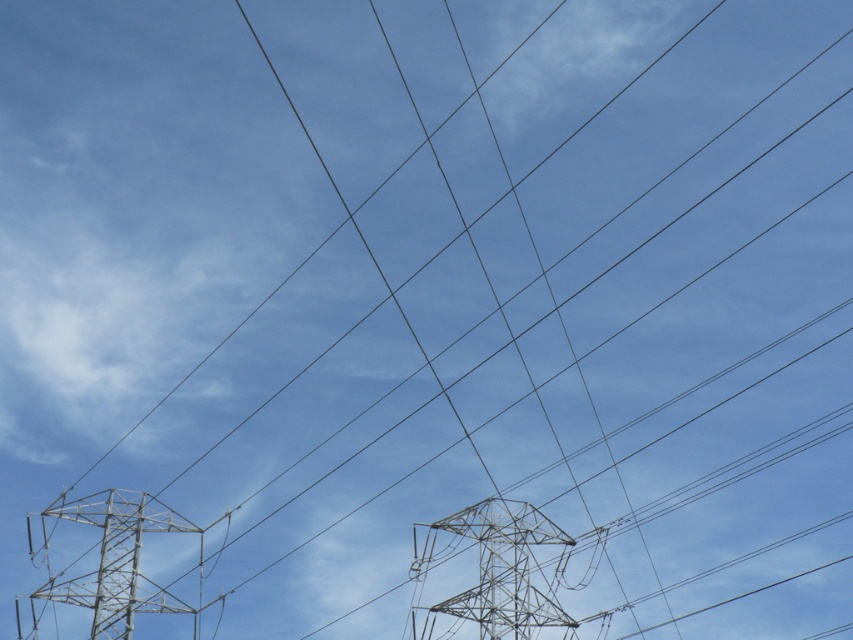
Question: Which point is farther to the camera?

Choices:
 (A) (515, 547)
 (B) (132, 604)

Answer: (B)

Question: Can you confirm if metallic silver tower at center is positioned to the right of metallic silver tower at lower left?

Choices:
 (A) yes
 (B) no

Answer: (A)

Question: Can you confirm if metallic silver tower at center is bigger than metallic silver tower at lower left?

Choices:
 (A) yes
 (B) no

Answer: (B)

Question: Which point is farther to the camera?

Choices:
 (A) metallic silver tower at center
 (B) metallic silver tower at lower left

Answer: (B)

Question: Does metallic silver tower at center appear under metallic silver tower at lower left?

Choices:
 (A) no
 (B) yes

Answer: (B)

Question: Which point is farther from the camera taking this photo?

Choices:
 (A) (505, 602)
 (B) (102, 637)

Answer: (B)